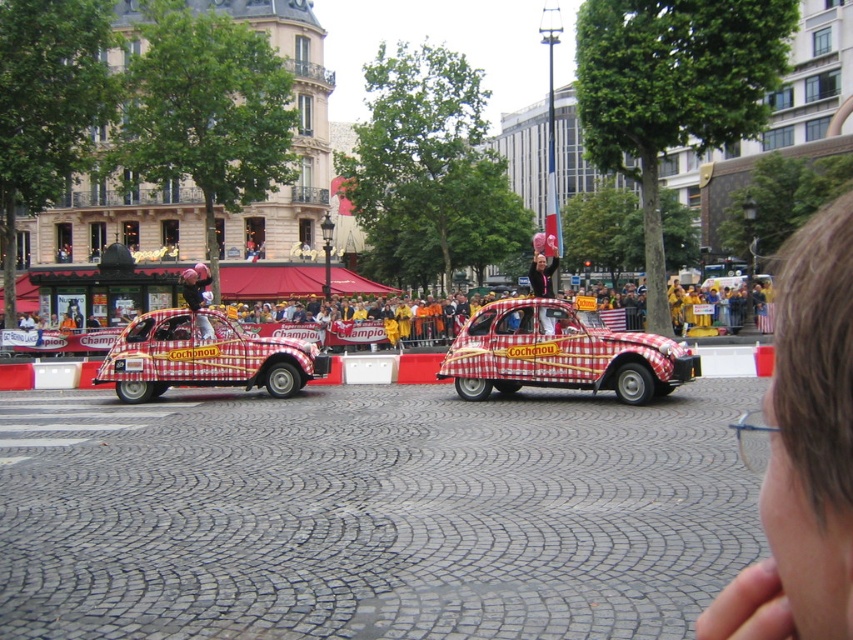
Question: Which of the following is the farthest from the observer?

Choices:
 (A) (555, 264)
 (B) (479, 368)
 (C) (824, 220)
 (D) (213, 376)

Answer: (D)

Question: Is brown hair at upper right in front of checkered fabric taxi at center?

Choices:
 (A) no
 (B) yes

Answer: (B)

Question: Estimate the real-world distances between objects in this image. Which object is farther from the checkered fabric taxi at left?

Choices:
 (A) checkered fabric taxi at center
 (B) matte red car at center

Answer: (A)

Question: Is brown hair at upper right thinner than checkered fabric taxi at center?

Choices:
 (A) no
 (B) yes

Answer: (A)

Question: Which point is closer to the camera?

Choices:
 (A) brown hair at upper right
 (B) checkered fabric taxi at center
 (C) matte red car at center

Answer: (A)

Question: Does checkered fabric taxi at center appear on the left side of matte red car at center?

Choices:
 (A) no
 (B) yes

Answer: (A)